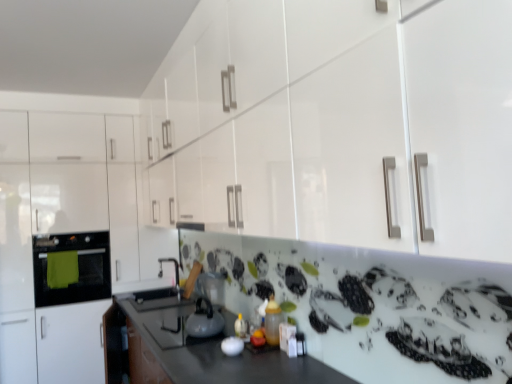
Question: In the image, is white glossy kettle at center, positioned as the 1th appliance in right-to-left order, positioned in front of or behind matte black oven at left?

Choices:
 (A) front
 (B) behind

Answer: (A)

Question: Is white glossy kettle at center, positioned as the first appliance in front-to-back order, situated inside matte black oven at left or outside?

Choices:
 (A) inside
 (B) outside

Answer: (B)

Question: Which is nearer to the white glossy kettle at center, the 2th appliance from the left?

Choices:
 (A) matte black oven at left
 (B) white glossy cabinet at left
 (C) satin silver kettle at center, which appears as the second appliance when viewed from the front
 (D) white glossy kettle at center

Answer: (D)

Question: Which object is positioned closest to the white glossy cabinet at left?

Choices:
 (A) white glossy kettle at center
 (B) matte black oven at left
 (C) white glossy kettle at center, positioned as the 1th appliance in right-to-left order
 (D) satin silver kettle at center, which is the second appliance in right-to-left order

Answer: (B)